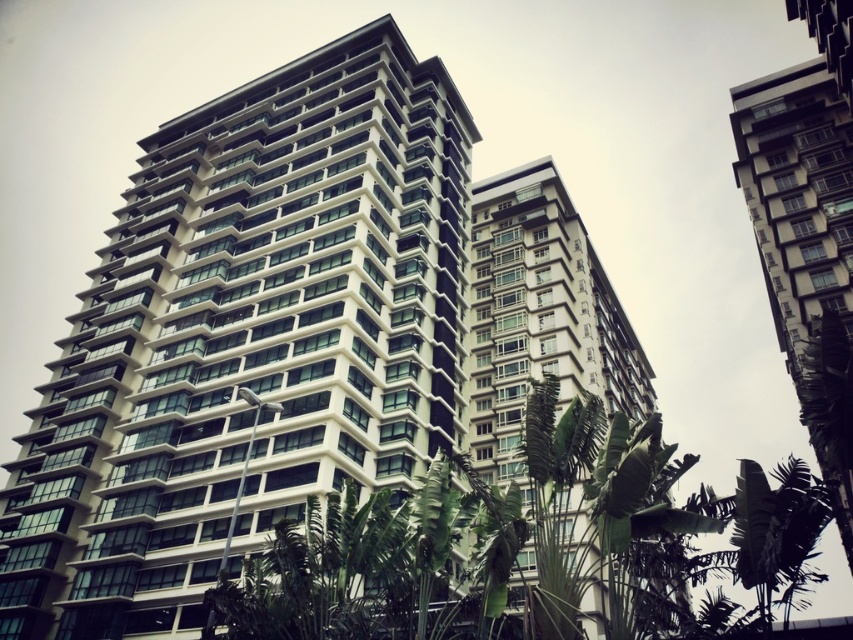
Between white glossy building at center and green leafy tree at center, which one appears on the left side from the viewer's perspective?

white glossy building at center is more to the left.

Does white glossy building at center lie in front of green leafy tree at center?

No, white glossy building at center is behind green leafy tree at center.

Between point (303, 72) and point (624, 540), which one is positioned behind?

Positioned behind is point (303, 72).

Locate an element on the screen. The image size is (853, 640). white glossy building at center is located at coordinates (247, 339).

Can you confirm if white glossy building at center is positioned to the left of white glass building at center?

Indeed, white glossy building at center is positioned on the left side of white glass building at center.

Does white glossy building at center lie in front of white glass building at center?

Yes, white glossy building at center is closer to the viewer.

This screenshot has height=640, width=853. What do you see at coordinates (247, 339) in the screenshot?
I see `white glossy building at center` at bounding box center [247, 339].

Identify the location of white glossy building at center. (247, 339).

Between green leafy tree at center and white glass building at center, which one has more height?

Standing taller between the two is green leafy tree at center.

Consider the image. Is green leafy tree at center below white glass building at center?

Correct, green leafy tree at center is located below white glass building at center.

What are the coordinates of `green leafy tree at center` in the screenshot? It's located at (532, 547).